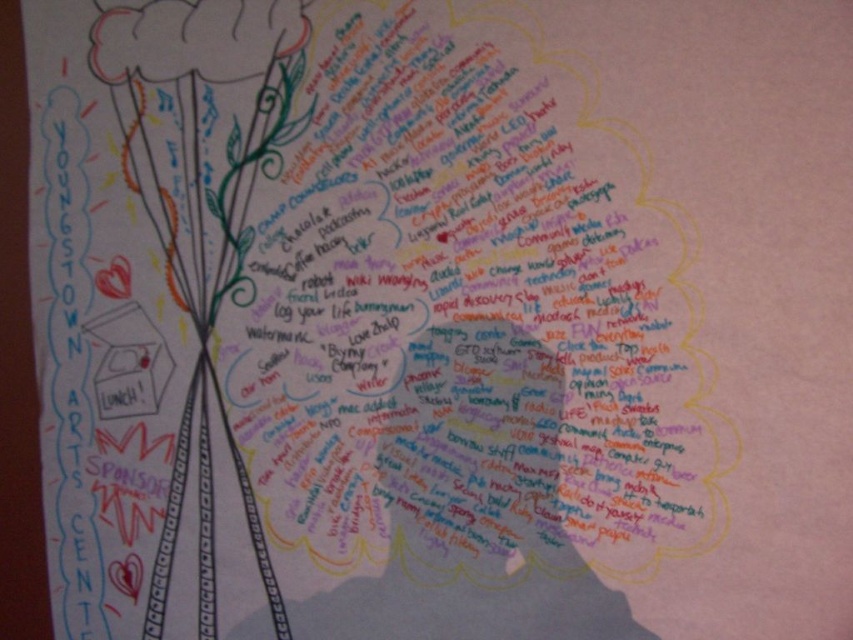
You are an artist planning to frame this poster. You need to know which object is narrower so you can position it closer to the edge of the frame. Which one is narrower between the green leafy tree at center and the matte paper flower at upper left?

The green leafy tree at center is narrower than the matte paper flower at upper left, so it should be positioned closer to the edge of the frame.

You are an artist analyzing the poster and want to place a new element at the exact coordinates of point (202, 216). Based on the scene description, what existing element will this new element overlap with?

The point (202, 216) is on the green leafy tree at center, so the new element will overlap with the green leafy tree at center.

You are an artist who wants to create a new design that fits within the existing artwork. You need to know which object is larger so you can scale your new element appropriately. Which object is larger between the green leafy tree at center and the matte paper flower at upper left?

The green leafy tree at center is bigger than the matte paper flower at upper left, so you should scale your new element to match the size of the larger object.